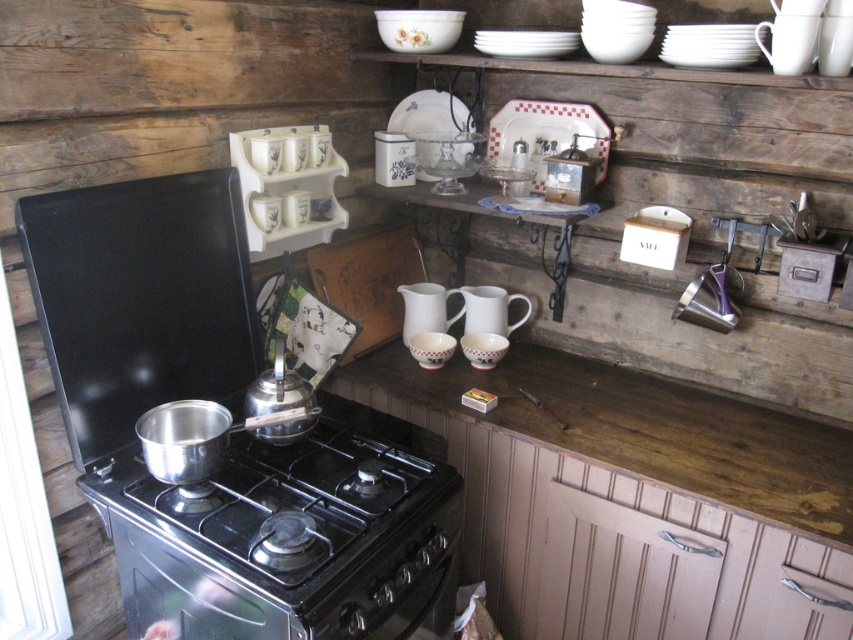
You are preparing to pour water from both the white matte pitcher at center and the white porcelain pitcher at center. Which pitcher is located below the other?

The white matte pitcher at center is positioned under the white porcelain pitcher at center, so it is located below the white porcelain pitcher at center.

You are standing in the kitchen and want to take a photo of the white matte pitcher at center. If your camera is 6.57 feet away from the pitcher, is it within the recommended 8 feet distance for clear photos?

Yes, the white matte pitcher at center and camera are 6.57 feet apart, which is within the recommended 8 feet distance for clear photos.

You are a chef preparing a dish in the kitchen. You need to place a white glossy plate at upper center on the counter. Where exactly should you place it?

The white glossy plate at upper center should be placed at the coordinates point [547,134].